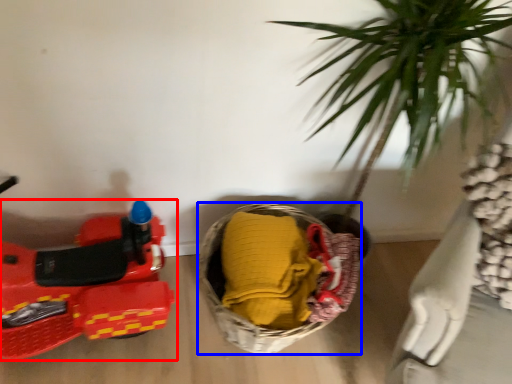
Question: Which object appears closest to the camera in this image, land vehicle (highlighted by a red box) or basket (highlighted by a blue box)?

Choices:
 (A) land vehicle
 (B) basket

Answer: (A)